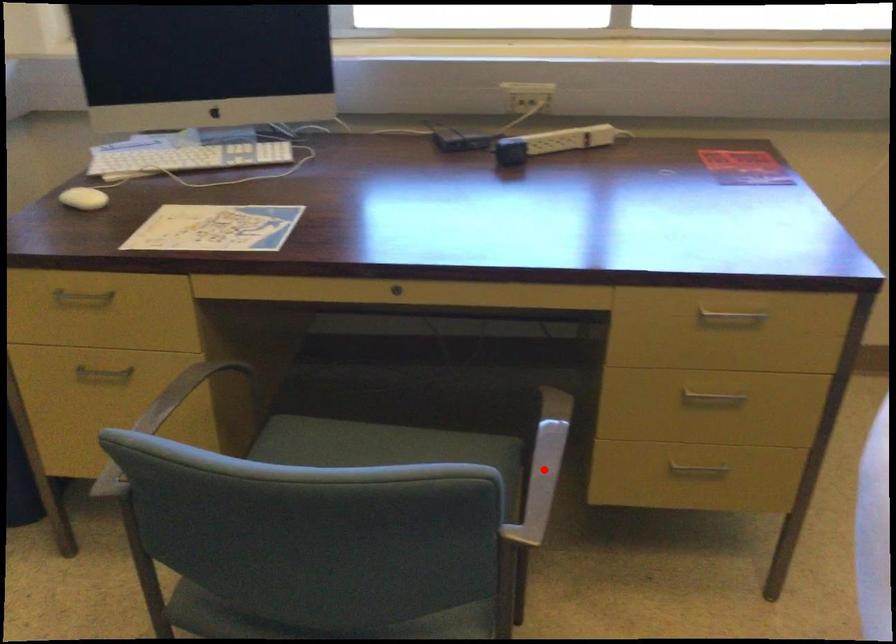
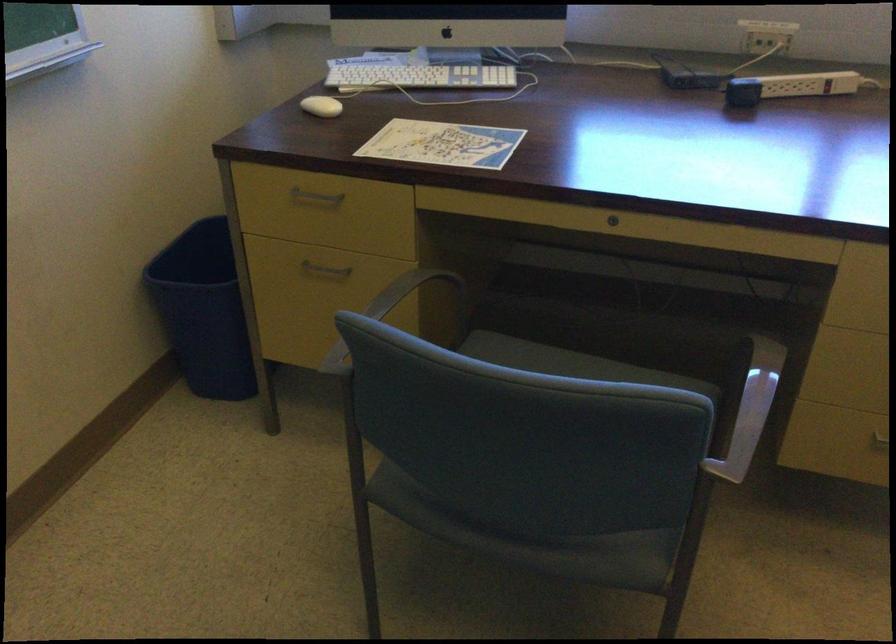
The point at the highlighted location is marked in the first image. Where is the corresponding point in the second image?

(750, 410)